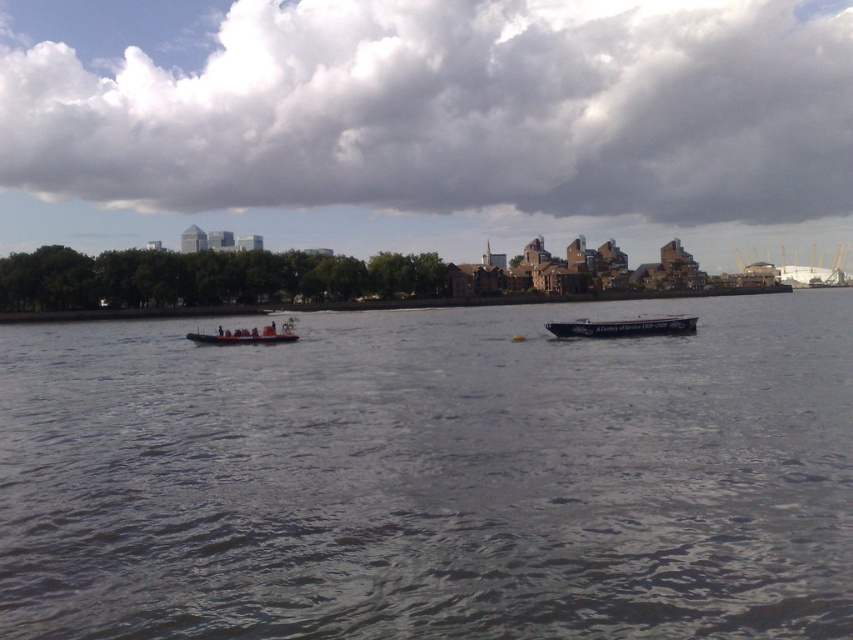
Question: Which point is farther to the camera?

Choices:
 (A) (589, 324)
 (B) (335, 449)
 (C) (244, 339)

Answer: (C)

Question: Among these points, which one is nearest to the camera?

Choices:
 (A) (132, 390)
 (B) (694, 328)
 (C) (238, 336)

Answer: (A)

Question: Which of these objects is positioned farthest from the dark gray water at center?

Choices:
 (A) blue painted wooden boat at center
 (B) orange rubber boat at center

Answer: (B)

Question: In this image, where is dark gray water at center located relative to orange rubber boat at center?

Choices:
 (A) right
 (B) left

Answer: (A)

Question: Can you confirm if dark gray water at center is smaller than orange rubber boat at center?

Choices:
 (A) no
 (B) yes

Answer: (A)

Question: Is dark gray water at center thinner than orange rubber boat at center?

Choices:
 (A) no
 (B) yes

Answer: (A)